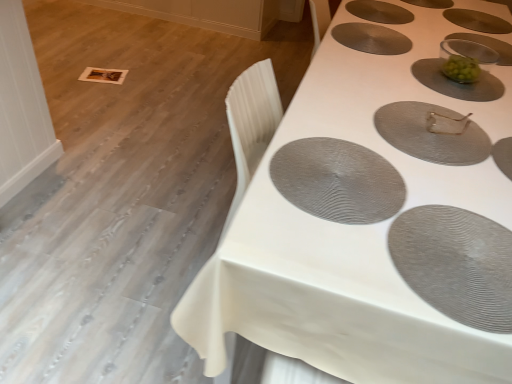
Question: Considering the relative sizes of matte gray placemat at upper right, which is the 7th oval from front to back, and green matte bowl at upper right, the 4th oval from the front, in the image provided, is matte gray placemat at upper right, which is the 7th oval from front to back, smaller than green matte bowl at upper right, the 4th oval from the front,?

Choices:
 (A) yes
 (B) no

Answer: (A)

Question: Does matte gray placemat at upper right, which is the 7th oval from front to back, have a lesser height compared to green matte bowl at upper right, which is the fourth oval from back to front?

Choices:
 (A) no
 (B) yes

Answer: (A)

Question: Could you tell me if matte gray placemat at upper right, which is the first oval from back to front, is facing green matte bowl at upper right, the 4th oval from the front?

Choices:
 (A) yes
 (B) no

Answer: (B)

Question: Is matte gray placemat at upper right, which is the first oval from back to front, closer to the viewer compared to green matte bowl at upper right, which is the fourth oval from back to front?

Choices:
 (A) yes
 (B) no

Answer: (B)

Question: Is matte gray placemat at upper right, which is the first oval from back to front, positioned behind green matte bowl at upper right, which is the fourth oval from back to front?

Choices:
 (A) yes
 (B) no

Answer: (A)

Question: From a real-world perspective, is matte gray placemat at upper right, which is the first oval from back to front, above or below white textured table at upper right?

Choices:
 (A) below
 (B) above

Answer: (B)

Question: Do you think matte gray placemat at upper right, which is the first oval from back to front, is within white textured table at upper right, or outside of it?

Choices:
 (A) inside
 (B) outside

Answer: (A)

Question: Is matte gray placemat at upper right, which is the 7th oval from front to back, to the left or to the right of white textured table at upper right in the image?

Choices:
 (A) right
 (B) left

Answer: (A)

Question: In terms of height, does matte gray placemat at upper right, which is the 7th oval from front to back, look taller or shorter compared to white textured table at upper right?

Choices:
 (A) short
 (B) tall

Answer: (A)

Question: In terms of width, does gray textured placemat at lower right, arranged as the seventh oval when viewed from the back, look wider or thinner when compared to matte gray placemat at upper center, arranged as the third oval when viewed from the back?

Choices:
 (A) thin
 (B) wide

Answer: (B)

Question: Is point (451, 218) positioned closer to the camera than point (379, 49)?

Choices:
 (A) farther
 (B) closer

Answer: (B)

Question: In terms of height, does gray textured placemat at lower right, the first oval from the front, look taller or shorter compared to matte gray placemat at upper center, positioned as the fifth oval in front-to-back order?

Choices:
 (A) tall
 (B) short

Answer: (B)

Question: Based on their positions, is gray textured placemat at lower right, arranged as the seventh oval when viewed from the back, located to the left or right of matte gray placemat at upper center, arranged as the third oval when viewed from the back?

Choices:
 (A) left
 (B) right

Answer: (A)

Question: Is green matte bowl at upper right, the 4th oval from the front, bigger or smaller than gray textured placemat at lower right, the first oval from the front?

Choices:
 (A) big
 (B) small

Answer: (B)

Question: Is point (445, 94) closer or farther from the camera than point (501, 251)?

Choices:
 (A) closer
 (B) farther

Answer: (B)